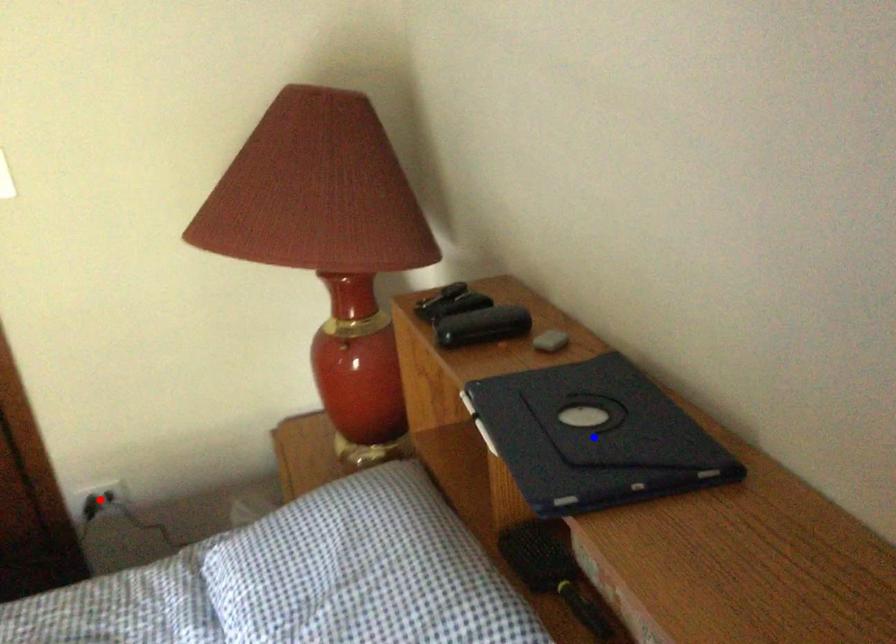
Question: Two points are marked on the image. Which point is closer to the camera?

Choices:
 (A) Blue point is closer.
 (B) Red point is closer.

Answer: (A)